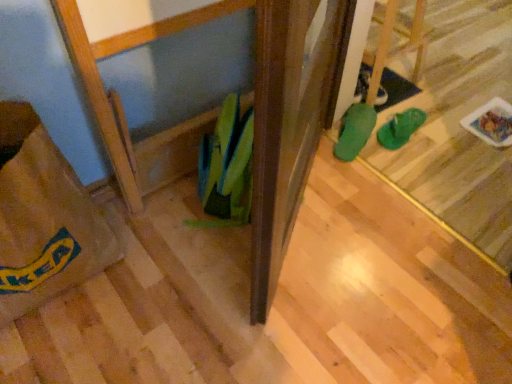
Question: From a real-world perspective, is green rubber flip-flops at center, the second footwear when ordered from left to right, positioned above or below brown paper bag at lower left?

Choices:
 (A) above
 (B) below

Answer: (B)

Question: Based on their sizes in the image, would you say green rubber flip-flops at center, the second footwear when ordered from left to right, is bigger or smaller than brown paper bag at lower left?

Choices:
 (A) small
 (B) big

Answer: (A)

Question: Based on their relative distances, which object is farther from the brown paper bag at lower left?

Choices:
 (A) green rubber boot at center, marked as the second footwear in a right-to-left arrangement
 (B) green rubber flip-flops at center, the first footwear in the right-to-left sequence

Answer: (B)

Question: Which object is positioned farthest from the brown paper bag at lower left?

Choices:
 (A) green rubber flip-flops at center, the second footwear when ordered from left to right
 (B) green rubber boot at center, placed as the first footwear when sorted from left to right

Answer: (A)